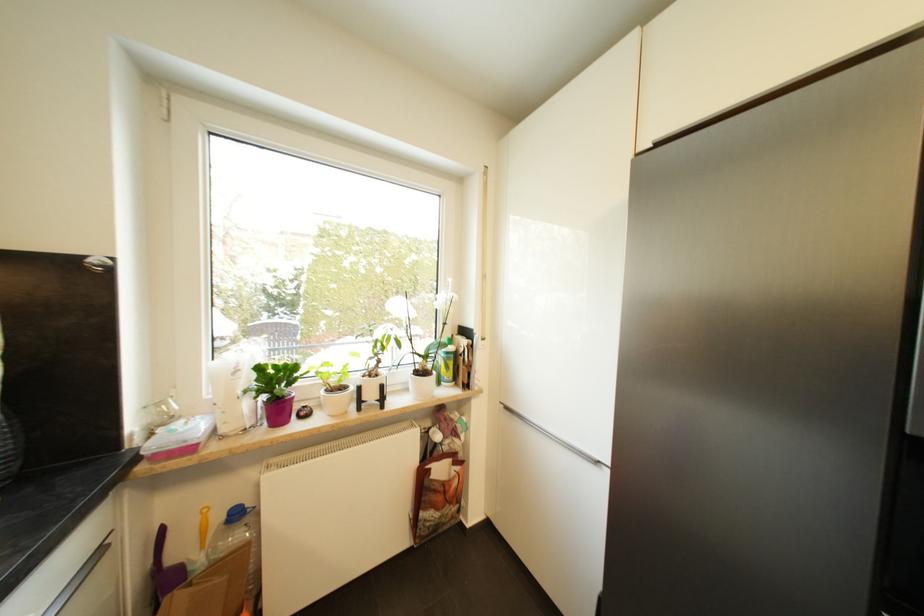
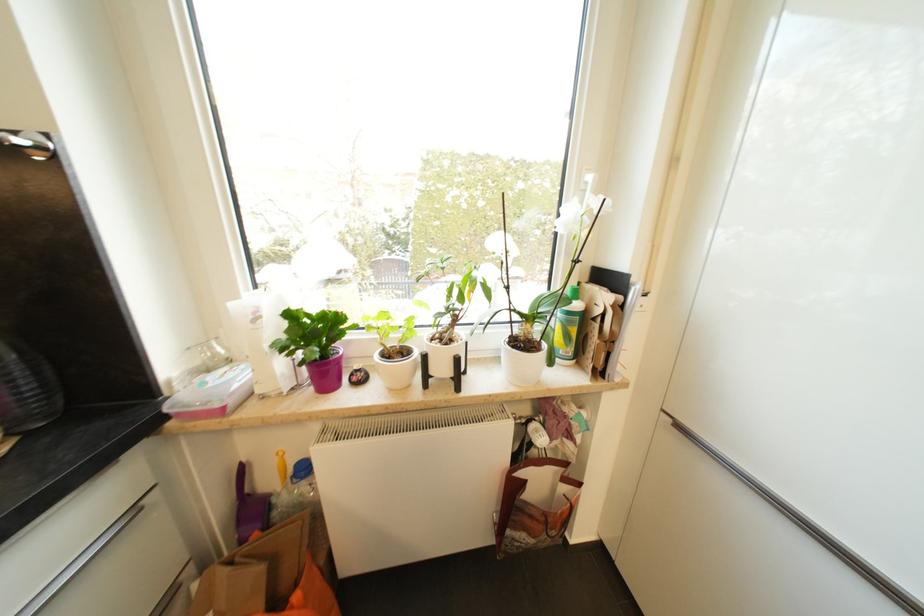
The point at (453, 355) is marked in the first image. Where is the corresponding point in the second image?

(574, 315)